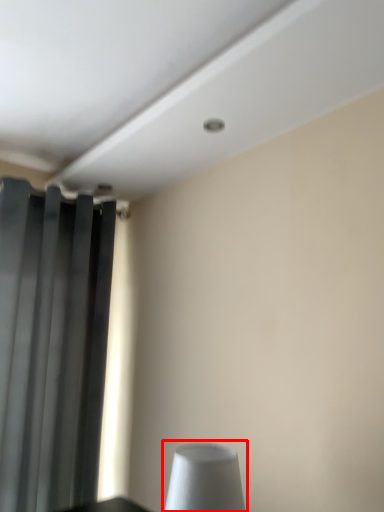
Question: Where is table lamp (annotated by the red box) located in relation to curtain in the image?

Choices:
 (A) right
 (B) left

Answer: (A)